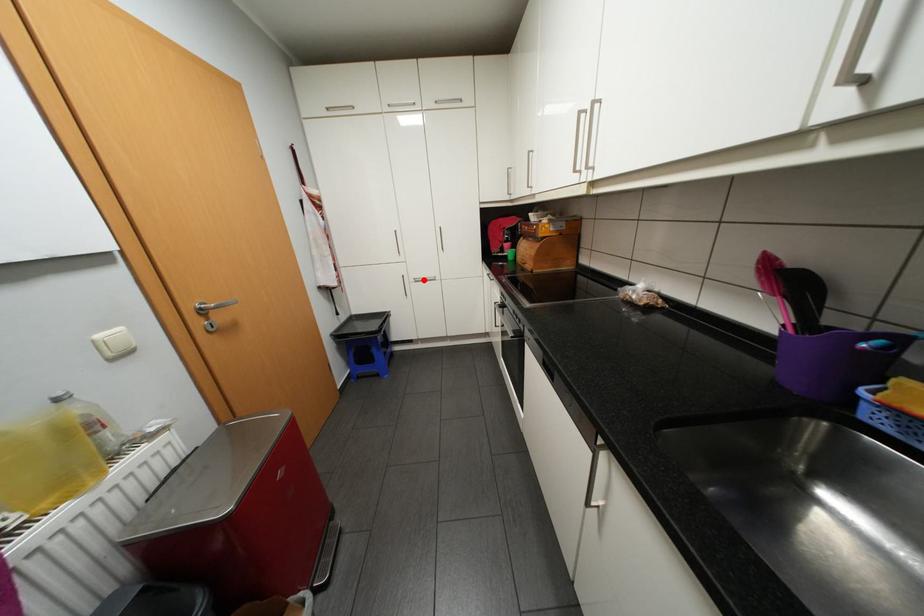
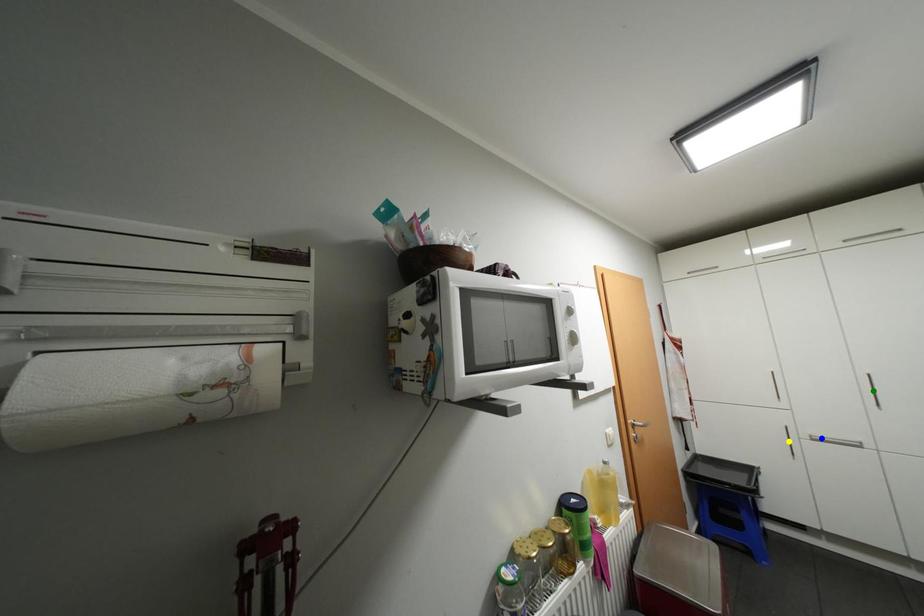
Question: I am providing you with two images of the same scene from different viewpoints. A red point is marked on the first image. You are given multiple points on the second image. Which mark in image 2 goes with the point in image 1?

Choices:
 (A) yellow point
 (B) blue point
 (C) green point

Answer: (B)